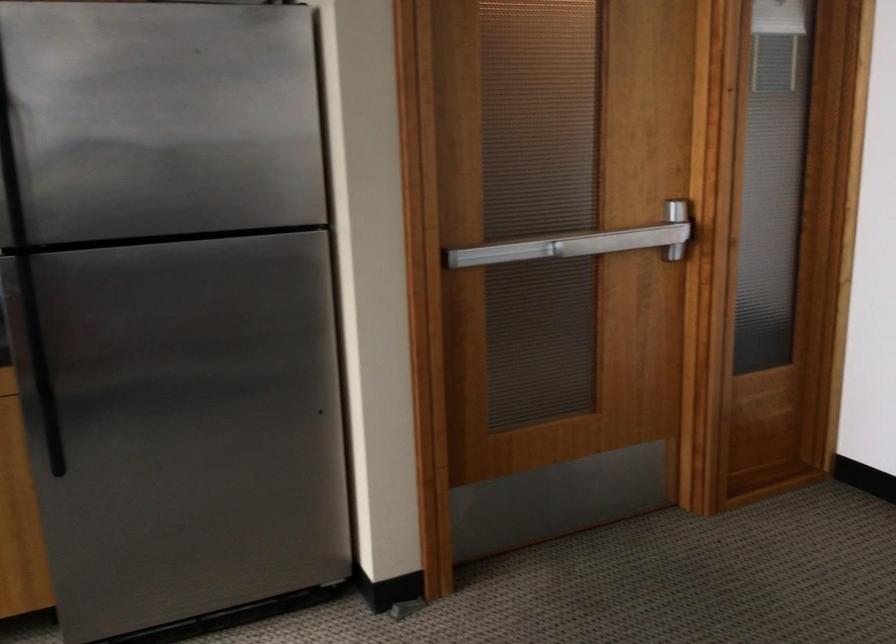
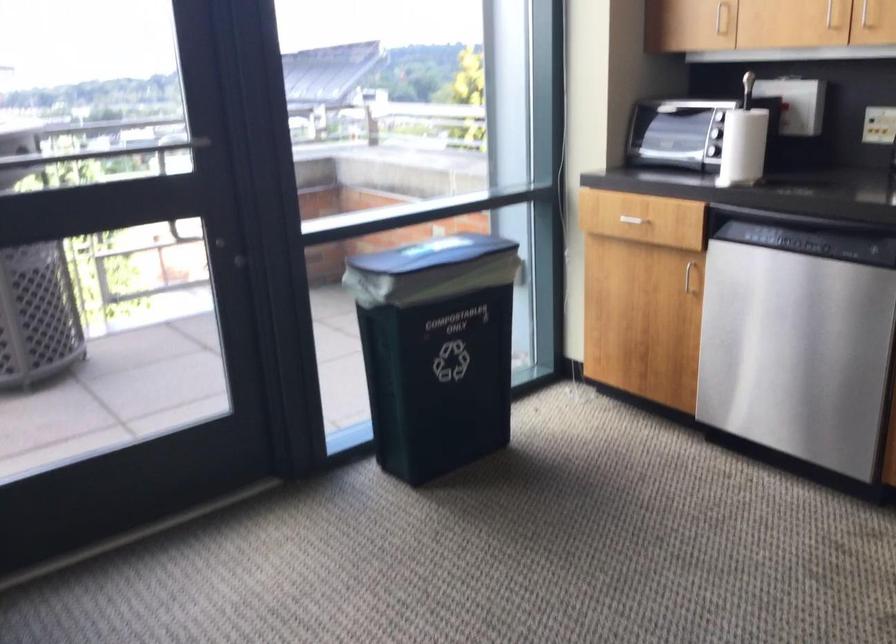
The images are taken continuously from a first-person perspective. In which direction is your viewpoint rotating?

The rotation direction of the camera is left-down.